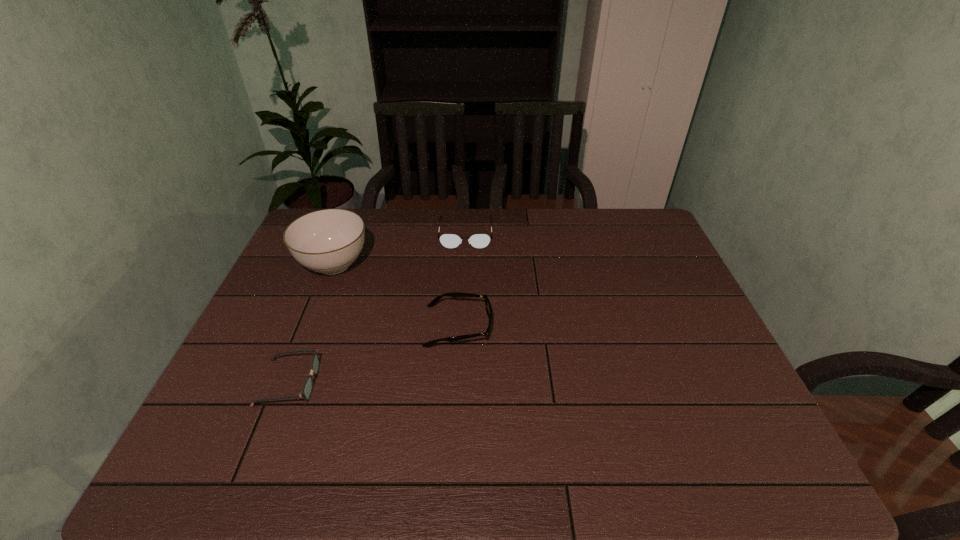
Locate which object is the second closest to the chinaware. Please provide its 2D coordinates. Your answer should be formatted as a tuple, i.e. [(x, y)], where the tuple contains the x and y coordinates of a point satisfying the conditions above.

[(479, 241)]

Point out which object is positioned as the second nearest to the farthest spectacles. Please provide its 2D coordinates. Your answer should be formatted as a tuple, i.e. [(x, y)], where the tuple contains the x and y coordinates of a point satisfying the conditions above.

[(487, 303)]

Locate which spectacles ranks third in proximity to the tallest object. Please provide its 2D coordinates. Your answer should be formatted as a tuple, i.e. [(x, y)], where the tuple contains the x and y coordinates of a point satisfying the conditions above.

[(307, 389)]

I want to click on the closest spectacles relative to the leftmost spectacles, so click(x=487, y=303).

Identify the location of free space that satisfies the following two spatial constraints: 1. on the lenses of the farthest spectacles; 2. on the face of the nearest spectacles. 460,382.

In order to click on free space in the image that satisfies the following two spatial constraints: 1. on the lenses of the farthest spectacles; 2. on the front-facing side of the second farthest spectacles in this screenshot , I will do `click(462, 326)`.

Where is `free spot that satisfies the following two spatial constraints: 1. on the lenses of the farthest spectacles; 2. on the front-facing side of the second nearest spectacles`? Image resolution: width=960 pixels, height=540 pixels. free spot that satisfies the following two spatial constraints: 1. on the lenses of the farthest spectacles; 2. on the front-facing side of the second nearest spectacles is located at coordinates (462, 326).

This screenshot has height=540, width=960. Find the location of `free location that satisfies the following two spatial constraints: 1. on the lenses of the farthest spectacles; 2. on the front-facing side of the second farthest spectacles`. free location that satisfies the following two spatial constraints: 1. on the lenses of the farthest spectacles; 2. on the front-facing side of the second farthest spectacles is located at coordinates (462, 326).